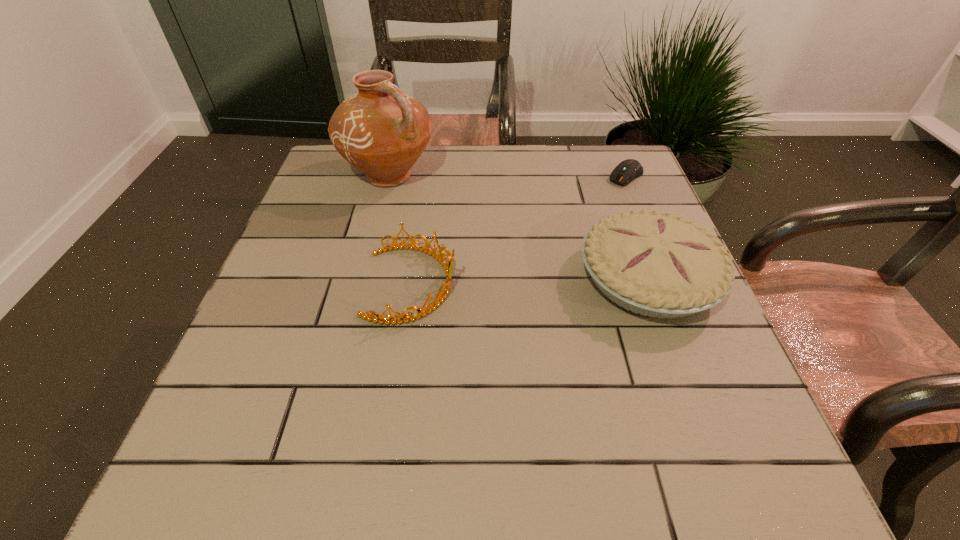
Identify the location of tiara. click(x=442, y=294).

You are a GUI agent. You are given a task and a screenshot of the screen. Output one action in this format:
    pyautogui.click(x=<x>, y=<y>)
    Task: Click on the pie
    The image size is (960, 540).
    Given the screenshot: What is the action you would take?
    pyautogui.click(x=654, y=264)

At what (x,y) coordinates should I click in order to perform the action: click on the shortest object. Please return your answer as a coordinate pair (x, y). The height and width of the screenshot is (540, 960). Looking at the image, I should click on (626, 171).

Find the location of `pottery`. pottery is located at coordinates (382, 131).

The height and width of the screenshot is (540, 960). I want to click on vacant space located 0.050m on the front-facing side of the tiara, so click(x=481, y=284).

Find the location of `vacant region located on the back of the pie`. vacant region located on the back of the pie is located at coordinates (612, 185).

Locate an element on the screen. blank space located 0.170m on the button of the shortest object is located at coordinates (582, 214).

Find the location of a particular element. The height and width of the screenshot is (540, 960). free location located 0.390m on the button of the shortest object is located at coordinates (528, 261).

Locate an element on the screen. The height and width of the screenshot is (540, 960). free space located 0.200m on the button of the shortest object is located at coordinates (575, 220).

The height and width of the screenshot is (540, 960). Find the location of `vacant space located 0.380m on the side of the pottery with the handle`. vacant space located 0.380m on the side of the pottery with the handle is located at coordinates (520, 277).